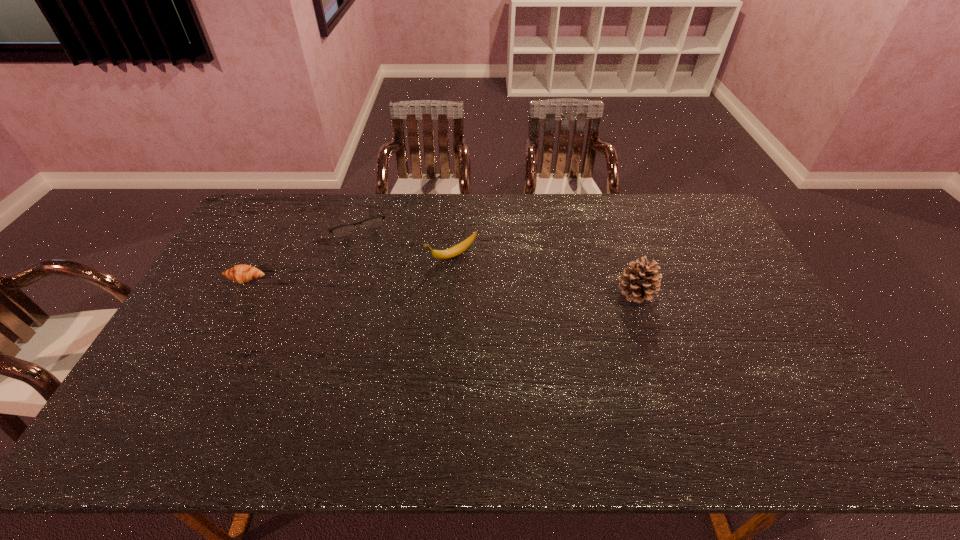
Identify the location of vacant point located on the front-facing side of the second object from left to right. (374, 267).

The height and width of the screenshot is (540, 960). I want to click on free spot located 0.320m on the front-facing side of the second object from left to right, so tap(389, 300).

At what (x,y) coordinates should I click in order to perform the action: click on vacant region located 0.350m at the stem of the banana. Please return your answer as a coordinate pair (x, y). Looking at the image, I should click on (328, 308).

The width and height of the screenshot is (960, 540). Identify the location of vacant space located at the stem of the banana. (392, 280).

At what (x,y) coordinates should I click in order to perform the action: click on vacant space positioned at the stem of the banana. Please return your answer as a coordinate pair (x, y). The width and height of the screenshot is (960, 540). Looking at the image, I should click on (395, 279).

At what (x,y) coordinates should I click in order to perform the action: click on object positioned at the far edge. Please return your answer as a coordinate pair (x, y). This screenshot has width=960, height=540. Looking at the image, I should click on (344, 230).

Locate an element on the screen. The image size is (960, 540). object located at the left edge is located at coordinates click(242, 273).

Find the location of a particular element. vacant region at the far edge of the desktop is located at coordinates (616, 194).

The image size is (960, 540). I want to click on vacant space at the near edge, so click(355, 376).

The height and width of the screenshot is (540, 960). Identify the location of vacant area at the left edge. (196, 341).